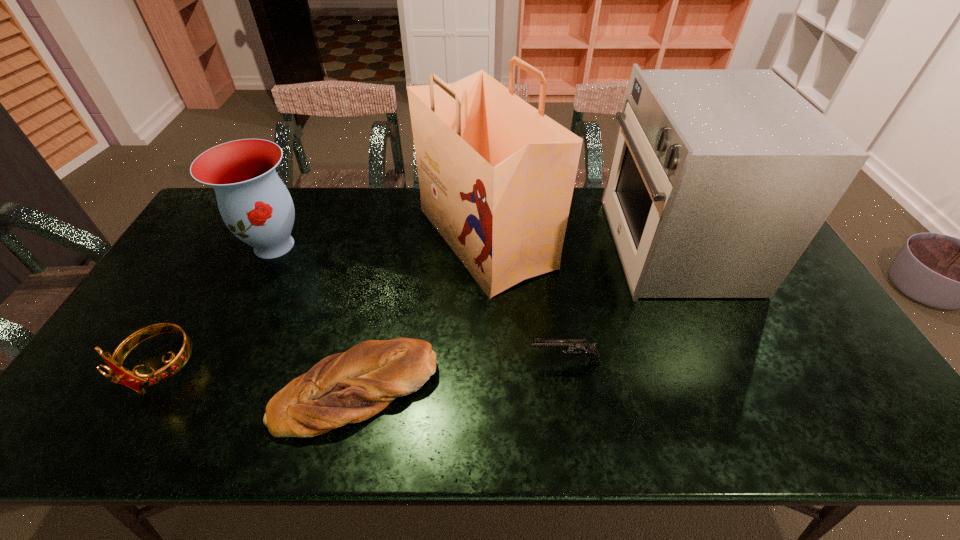
I want to click on vacant space located on the front panel of the rightmost object, so click(x=548, y=245).

Where is `blank space located on the front panel of the rightmost object`? blank space located on the front panel of the rightmost object is located at coordinates (579, 245).

I want to click on vacant position located on the front of the vase, so click(218, 361).

The width and height of the screenshot is (960, 540). I want to click on blank area located on the front-facing side of the tiara, so click(x=130, y=421).

Locate an element on the screen. vacant space located 0.210m at the end of the barrel of the gun is located at coordinates (446, 362).

At what (x,y) coordinates should I click in order to perform the action: click on vacant region located at the end of the barrel of the gun. Please return your answer as a coordinate pair (x, y). The image size is (960, 540). Looking at the image, I should click on (419, 362).

Image resolution: width=960 pixels, height=540 pixels. What are the coordinates of `free space located at the end of the barrel of the gun` in the screenshot? It's located at click(x=497, y=362).

This screenshot has width=960, height=540. In order to click on free space located 0.180m on the right of the shortest object in this screenshot , I will do `click(511, 391)`.

You are a GUI agent. You are given a task and a screenshot of the screen. Output one action in this format:
    pyautogui.click(x=<x>, y=<y>)
    Task: Click on the grocery bag at the far edge
    
    Given the screenshot: What is the action you would take?
    pyautogui.click(x=496, y=175)

Where is `toaster oven present at the far edge`? This screenshot has height=540, width=960. toaster oven present at the far edge is located at coordinates (719, 179).